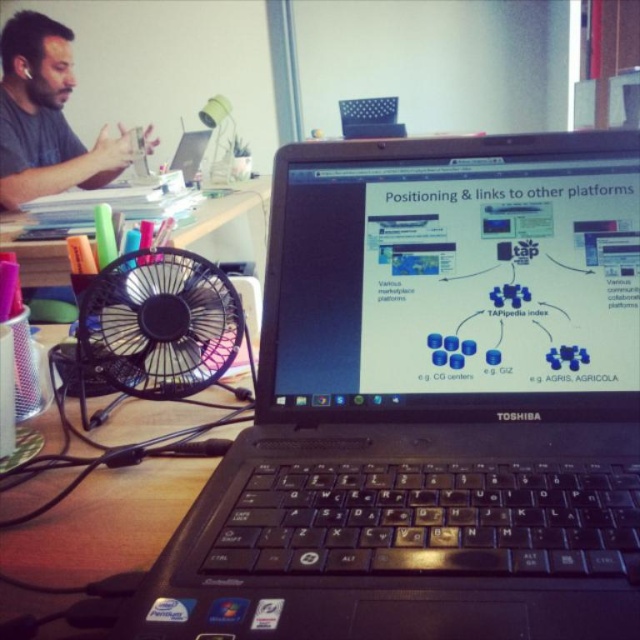
Who is positioned more to the right, matte black laptop at upper left or black plastic fan at left?

black plastic fan at left is more to the right.

Which is behind, point (38, 156) or point (241, 189)?

Point (241, 189)

Where is `matte black laptop at upper left`? The image size is (640, 640). matte black laptop at upper left is located at coordinates (45, 116).

Who is taller, black plastic laptop at center or black plastic fan at left?

black plastic fan at left

Looking at this image, is black plastic laptop at center shorter than black plastic fan at left?

Correct, black plastic laptop at center is not as tall as black plastic fan at left.

This screenshot has height=640, width=640. Identify the location of black plastic laptop at center. 429,404.

Is black plastic laptop at center to the left of black plastic fan at lower left from the viewer's perspective?

No, black plastic laptop at center is not to the left of black plastic fan at lower left.

Does black plastic laptop at center have a smaller size compared to black plastic fan at lower left?

Incorrect, black plastic laptop at center is not smaller in size than black plastic fan at lower left.

Identify the location of black plastic laptop at center. This screenshot has width=640, height=640. (429, 404).

Identify the location of black plastic laptop at center. The width and height of the screenshot is (640, 640). (429, 404).